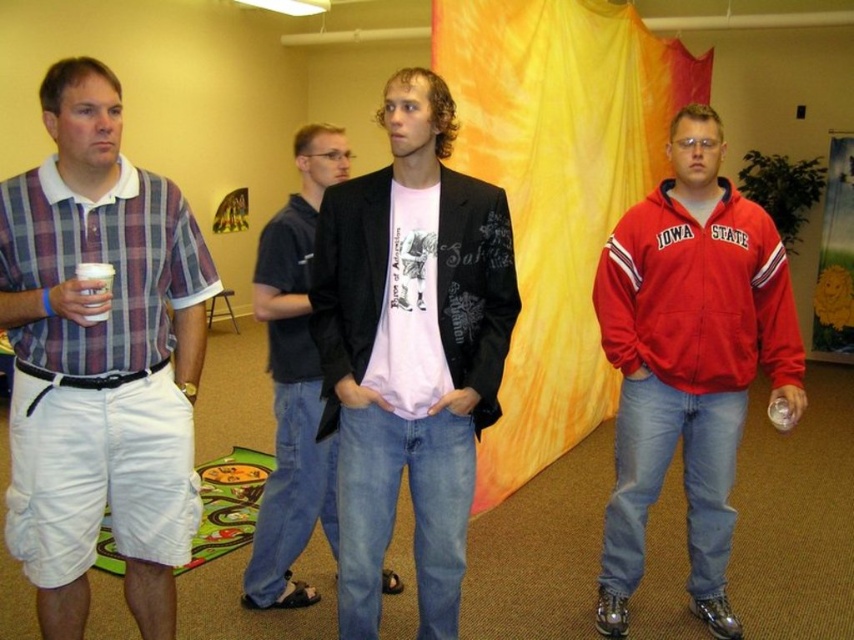
Who is positioned more to the left, red matte jacket at center or black matte jacket at center?

black matte jacket at center

What do you see at coordinates (688, 360) in the screenshot? This screenshot has width=854, height=640. I see `red matte jacket at center` at bounding box center [688, 360].

Who is more forward, (638, 236) or (325, 429)?

Point (325, 429) is in front.

This screenshot has width=854, height=640. I want to click on red matte jacket at center, so click(x=688, y=360).

What do you see at coordinates (98, 358) in the screenshot? This screenshot has height=640, width=854. I see `plaid cotton shirt at left` at bounding box center [98, 358].

Is point (144, 228) in front of point (288, 413)?

Yes, it is.

Between point (57, 452) and point (308, 282), which one is positioned behind?

The point (308, 282) is behind.

Locate an element on the screen. This screenshot has height=640, width=854. plaid cotton shirt at left is located at coordinates (98, 358).

Is point (642, 204) positioned in front of point (75, 273)?

No, (642, 204) is further to viewer.

Between red fleece jacket at right and white paper cup at left, which one appears on the left side from the viewer's perspective?

Positioned to the left is white paper cup at left.

Does point (757, 316) come in front of point (88, 316)?

No, it is not.

Where is `red fleece jacket at right`? This screenshot has height=640, width=854. red fleece jacket at right is located at coordinates (699, 296).